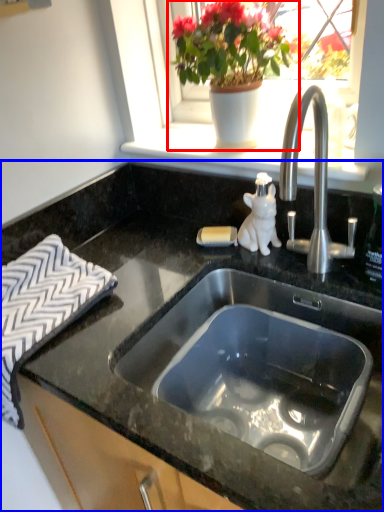
Question: Which point is further to the camera, houseplant (highlighted by a red box) or countertop (highlighted by a blue box)?

Choices:
 (A) houseplant
 (B) countertop

Answer: (A)